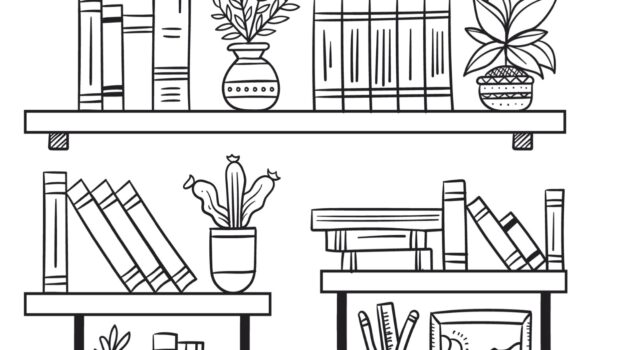
In order to click on wall shelves in this screenshot , I will do `click(228, 126)`, `click(149, 304)`, `click(366, 285)`, `click(342, 312)`, `click(544, 313)`, `click(246, 328)`, `click(73, 334)`, `click(51, 142)`, `click(524, 141)`.